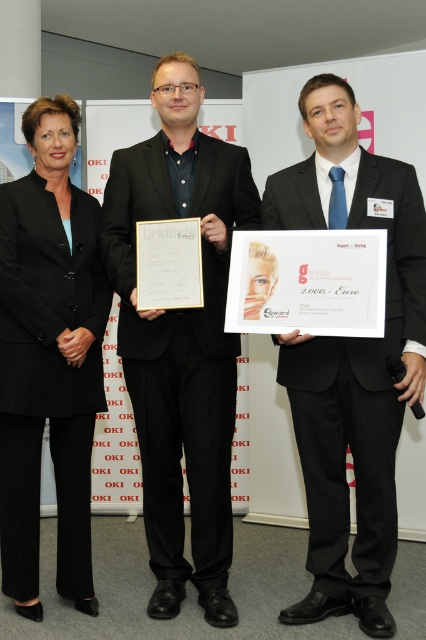
You are a photographer at the event and want to take a photo of both the black matte suit at center and the black glossy suit at center. Which suit will appear larger in the photo?

The black matte suit at center will appear larger in the photo because it is closer to the viewer than the black glossy suit at center.

You are standing at the entrance of the room and want to approach the person wearing the black matte suit at center. According to the coordinates provided, in which direction should you move from your current position to reach them?

The black matte suit at center is located at coordinates point (181, 339). Since you are at the entrance, you should move towards the center of the room to reach them.